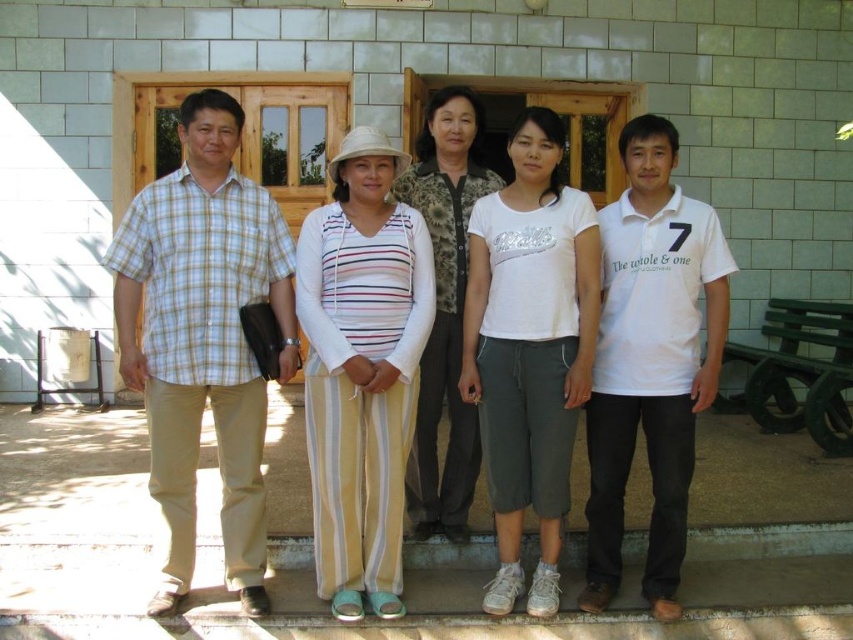
Question: From the image, what is the correct spatial relationship of striped fabric top at center in relation to white cotton t-shirt at center?

Choices:
 (A) right
 (B) left

Answer: (B)

Question: Is striped fabric top at center closer to the viewer compared to white cotton polo shirt at right?

Choices:
 (A) yes
 (B) no

Answer: (A)

Question: Is the position of striped fabric top at center more distant than that of white cotton t-shirt at center?

Choices:
 (A) no
 (B) yes

Answer: (A)

Question: Which of the following is the closest to the observer?

Choices:
 (A) white cotton polo shirt at right
 (B) striped fabric top at center
 (C) striped cotton shirt at center
 (D) white cotton t-shirt at center

Answer: (B)

Question: Which of the following is the farthest from the observer?

Choices:
 (A) striped cotton shirt at center
 (B) white cotton polo shirt at right

Answer: (B)

Question: Which object is positioned closest to the white cotton t-shirt at center?

Choices:
 (A) light brown plaid shirt at left
 (B) camouflage fabric vest at center

Answer: (B)